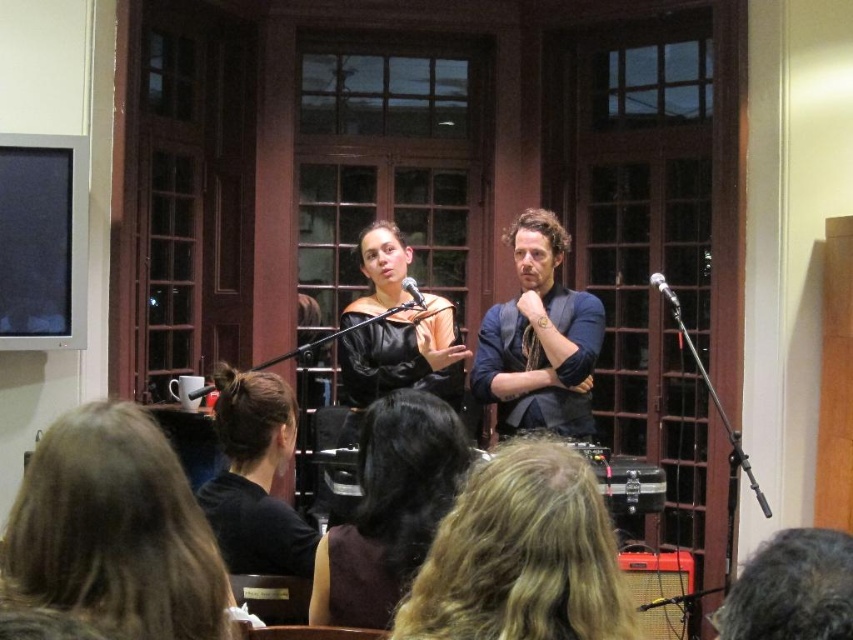
I want to click on blue fabric shirt at center, so click(538, 339).

Which is more to the right, blue fabric shirt at center or metallic silver microphone at center?

metallic silver microphone at center

Image resolution: width=853 pixels, height=640 pixels. What do you see at coordinates (538, 339) in the screenshot?
I see `blue fabric shirt at center` at bounding box center [538, 339].

Image resolution: width=853 pixels, height=640 pixels. I want to click on blue fabric shirt at center, so 538,339.

Does blue fabric shirt at center have a greater height compared to orange amplifier at lower right?

Yes.

Who is more forward, (602,330) or (683,625)?

Point (602,330) is more forward.

The height and width of the screenshot is (640, 853). In order to click on blue fabric shirt at center in this screenshot , I will do `click(538, 339)`.

Between dark brown leather jacket at center and black leather jacket at center, which one is positioned higher?

Positioned higher is black leather jacket at center.

Which is below, dark brown leather jacket at center or black leather jacket at center?

dark brown leather jacket at center

Identify the location of dark brown leather jacket at center. (389, 509).